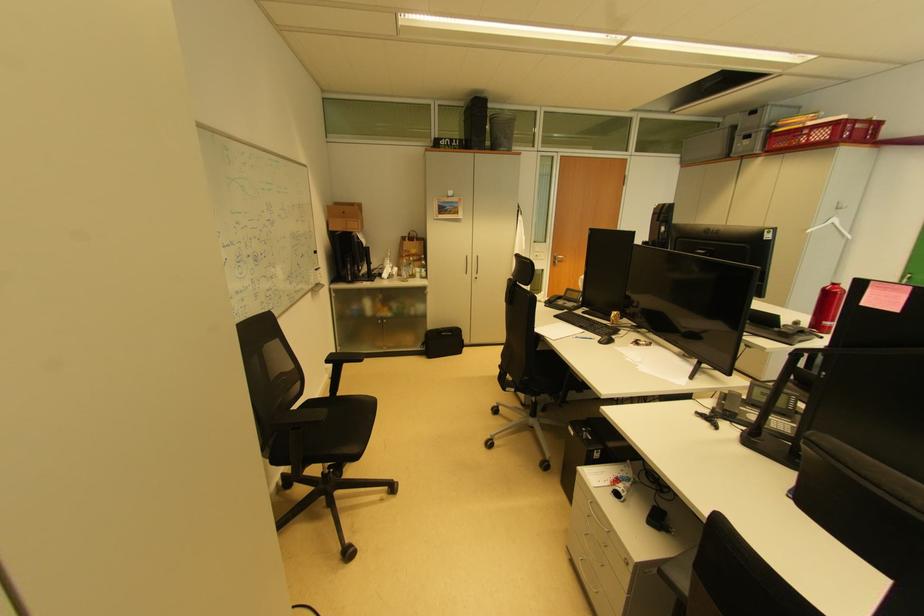
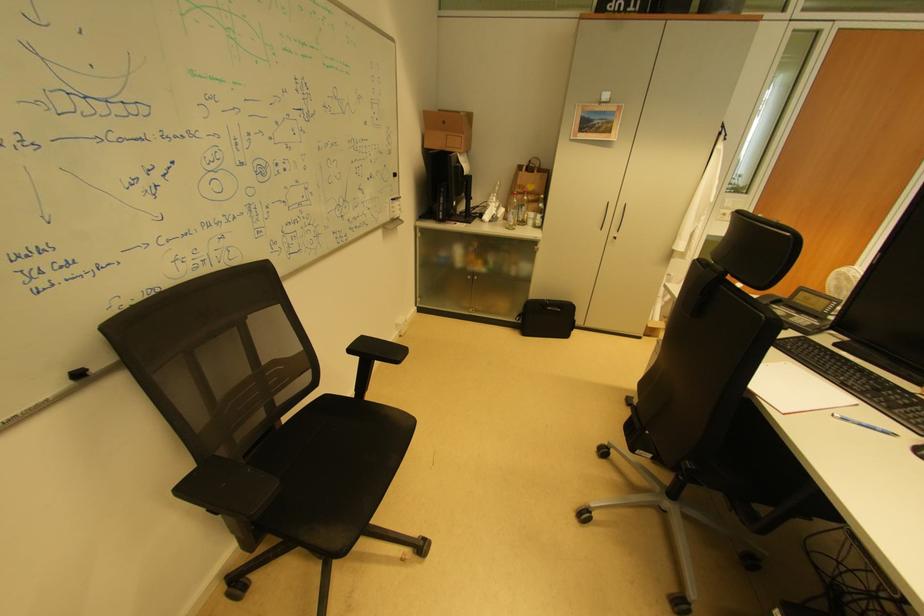
The point at (586, 339) is marked in the first image. Where is the corresponding point in the second image?

(853, 421)